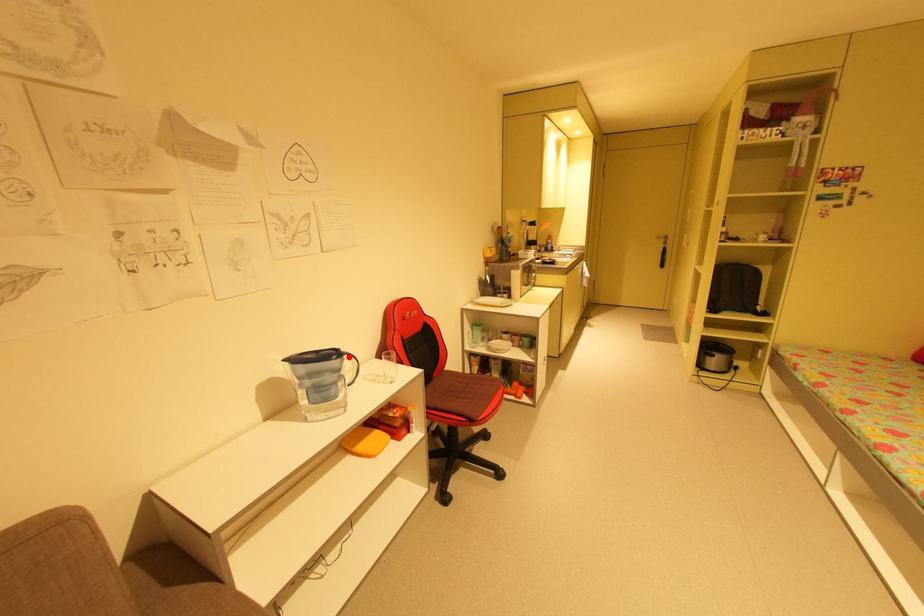
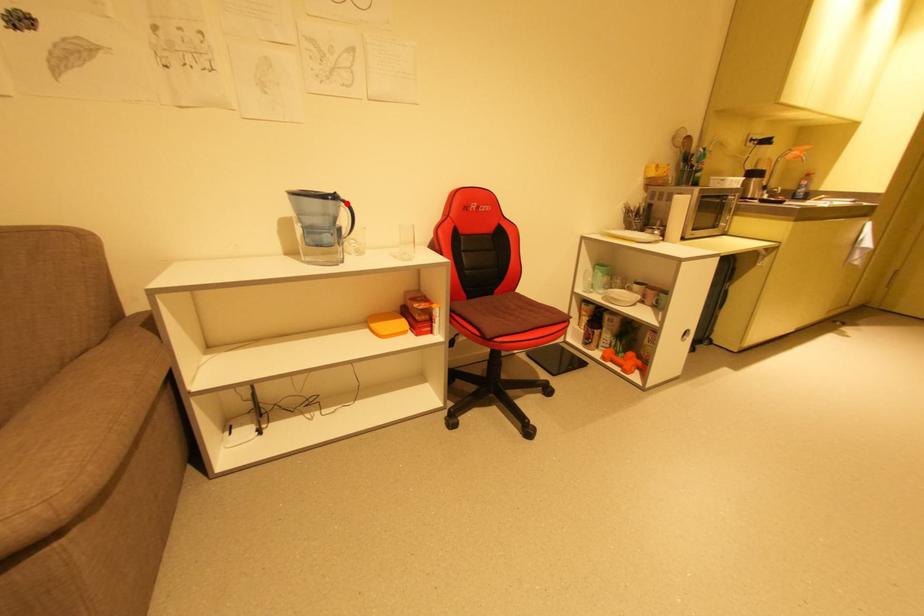
I am providing you with two images of the same scene from different viewpoints. A red point is marked on the first image and another point is marked on the second image. Is the marked point in image1 the same physical position as the marked point in image2?

Yes